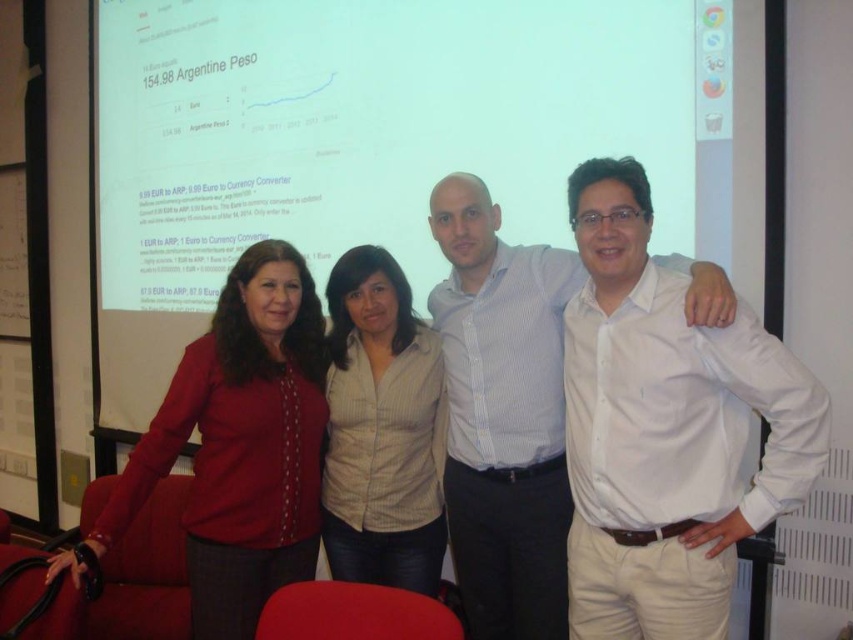
How much distance is there between white cotton shirt at right and white shirt at center?

white cotton shirt at right is 32.07 centimeters away from white shirt at center.

Between white cotton shirt at right and white shirt at center, which one appears on the right side from the viewer's perspective?

From the viewer's perspective, white cotton shirt at right appears more on the right side.

Which is behind, point (587, 612) or point (549, 428)?

Positioned behind is point (549, 428).

At what (x,y) coordinates should I click in order to perform the action: click on white cotton shirt at right. Please return your answer as a coordinate pair (x, y). Image resolution: width=853 pixels, height=640 pixels. Looking at the image, I should click on (665, 429).

Does white cotton shirt at right have a lesser width compared to matte red blouse at left?

Yes, white cotton shirt at right is thinner than matte red blouse at left.

Is white cotton shirt at right in front of matte red blouse at left?

That is True.

Does point (775, 483) come farther from viewer compared to point (190, 557)?

That is False.

What are the coordinates of `white cotton shirt at right` in the screenshot? It's located at (665, 429).

Does matte red blouse at left appear under white striped shirt at center?

Yes, matte red blouse at left is below white striped shirt at center.

Is point (142, 497) farther from camera compared to point (347, 314)?

That is False.

Find the location of `matte red blouse at left`. matte red blouse at left is located at coordinates (241, 444).